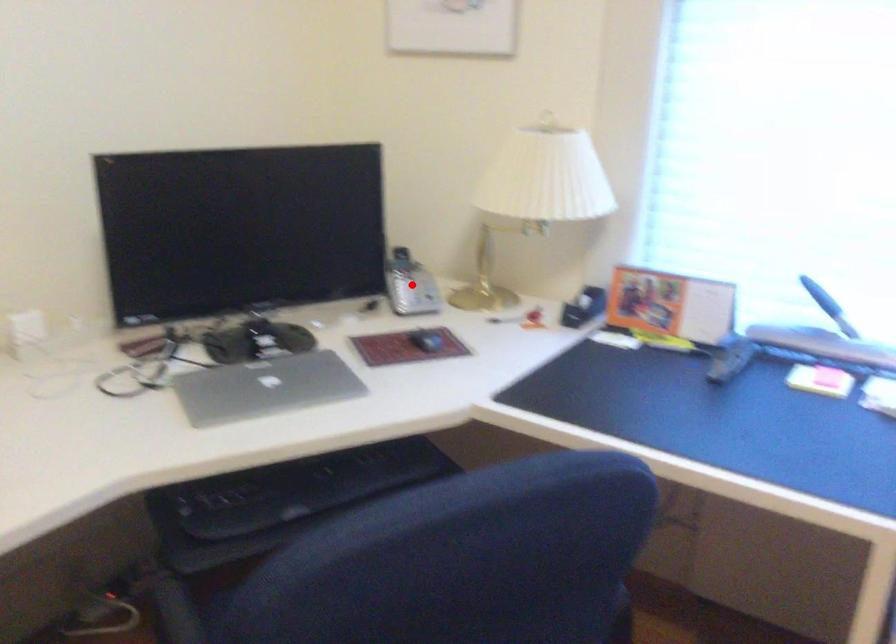
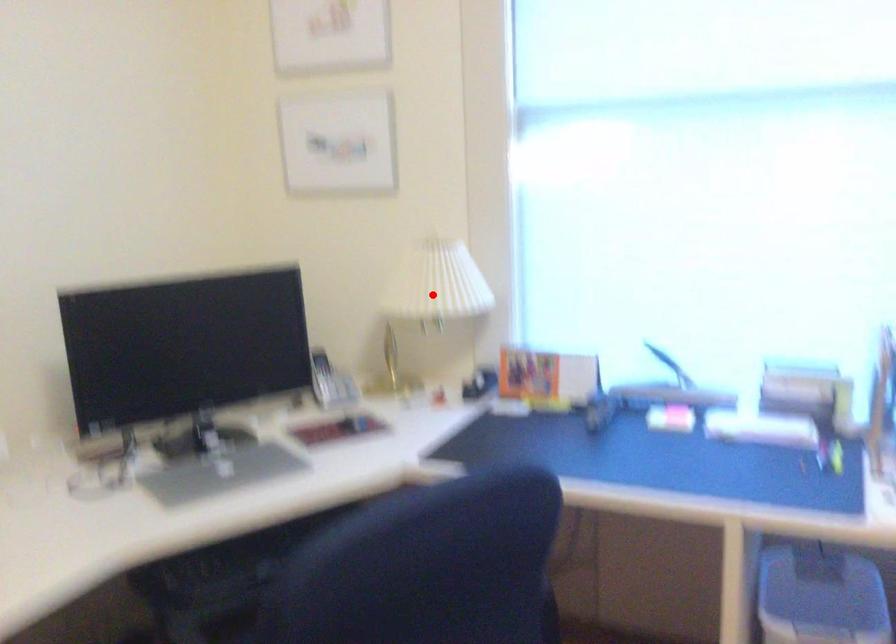
I am providing you with two images of the same scene from different viewpoints. A red point is marked on the first image and another point is marked on the second image. Does the point marked in image1 correspond to the same location as the one in image2?

No